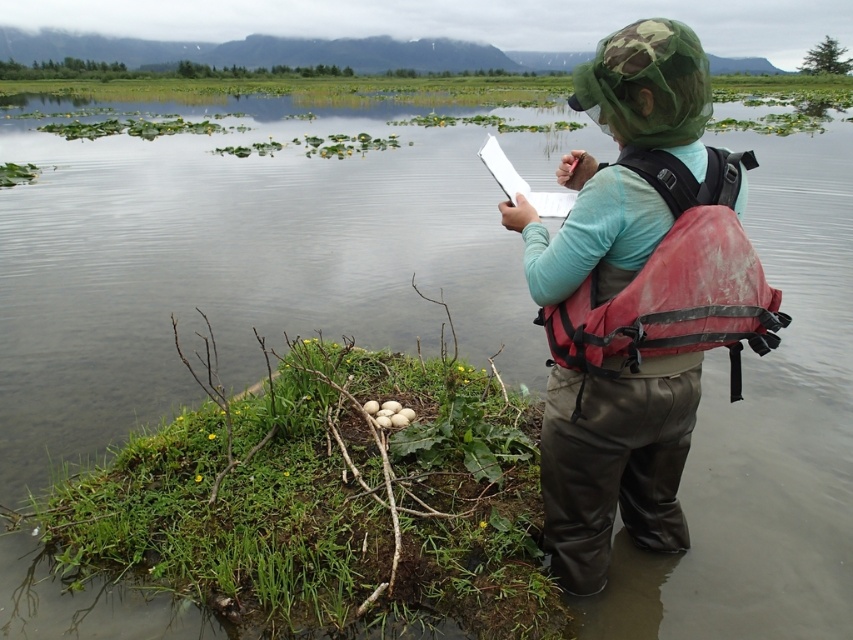
Who is more forward, [640,413] or [668,243]?

Positioned in front is point [668,243].

Does matte green hat at upper center have a lesser width compared to red nylon life jacket at back?

No, matte green hat at upper center is not thinner than red nylon life jacket at back.

This screenshot has width=853, height=640. Identify the location of matte green hat at upper center. (614, 461).